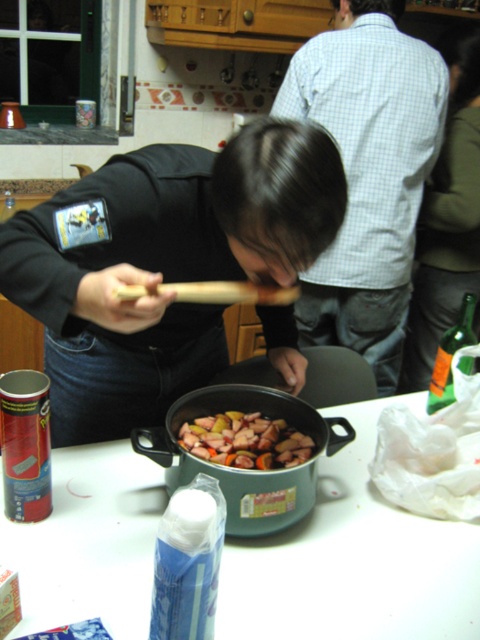
You are a chef in a busy kitchen and need to quickly identify where the light blue checkered shirt at upper center and the shiny metallic pot at center are located relative to each other. Which object is on the right side?

The light blue checkered shirt at upper center is positioned on the right side of the shiny metallic pot at center, so the light blue checkered shirt at upper center is on the right side.

You are a delivery person who just arrived at the kitchen. You need to place a package that is 25 inches long on the counter. Is there enough space between the white plastic bag at lower right and the edge of the counter?

The white plastic bag at lower right is 30.78 inches from the camera. Since the package is 25 inches long, there is enough space between the white plastic bag at lower right and the edge of the counter to place the package.

You are standing in the kitchen and want to reach both the point at coordinates point (x=220, y=580) and point (x=452, y=259). Which point is closer to you?

The point at coordinates point (x=220, y=580) is closer to you because it is in front of point (x=452, y=259).